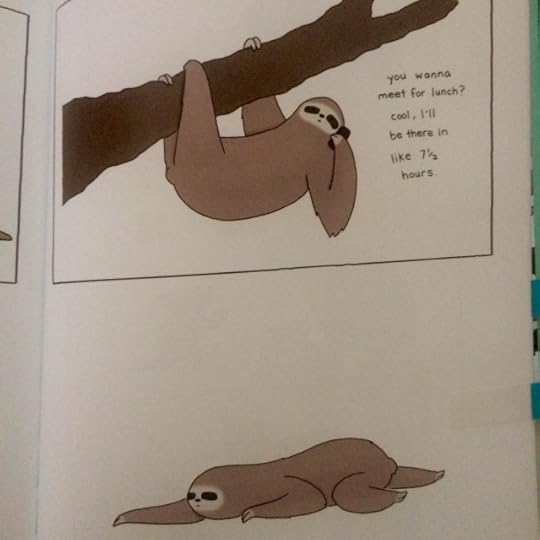
Image resolution: width=540 pixels, height=540 pixels. I want to click on phone, so click(349, 132).